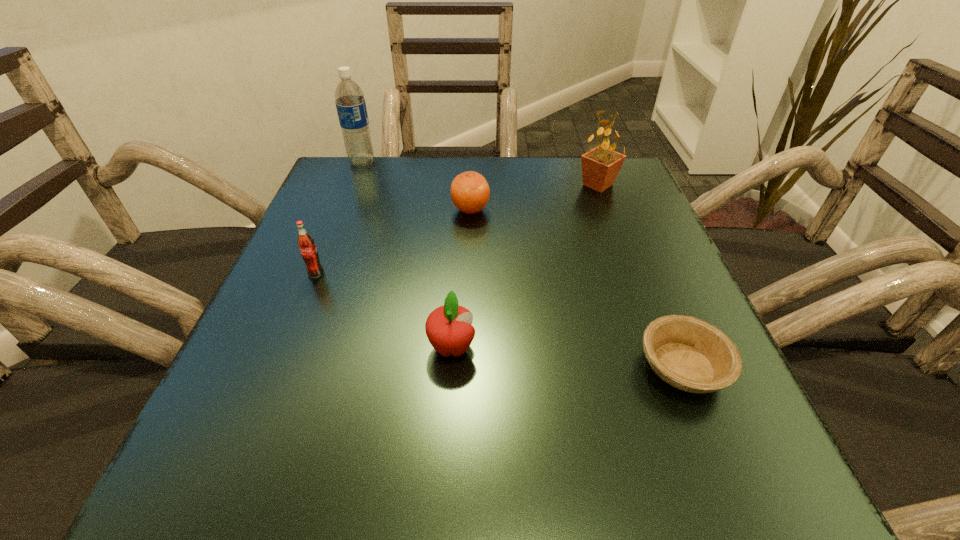
Locate an element on the screen. the tallest object is located at coordinates (351, 107).

At what (x,y) coordinates should I click in order to perform the action: click on the farthest object. Please return your answer as a coordinate pair (x, y). The image size is (960, 540). Looking at the image, I should click on (351, 107).

Where is `sunflower`? The width and height of the screenshot is (960, 540). sunflower is located at coordinates (600, 166).

The width and height of the screenshot is (960, 540). Identify the location of the second farthest object. (600, 166).

The image size is (960, 540). Identify the location of the fourth farthest object. (306, 244).

The image size is (960, 540). What are the coordinates of `soda bottle` in the screenshot? It's located at (306, 244).

You are a GUI agent. You are given a task and a screenshot of the screen. Output one action in this format:
    pyautogui.click(x=<x>, y=<y>)
    Task: Click on the apple
    This screenshot has width=960, height=540.
    Given the screenshot: What is the action you would take?
    pyautogui.click(x=449, y=329)

I want to click on the third farthest object, so click(x=470, y=191).

Where is `bowl`? The image size is (960, 540). bowl is located at coordinates (690, 354).

At what (x,y) coordinates should I click in order to perform the action: click on vacant space located 0.100m on the right of the farthest object. Please return your answer as a coordinate pair (x, y). Looking at the image, I should click on (416, 163).